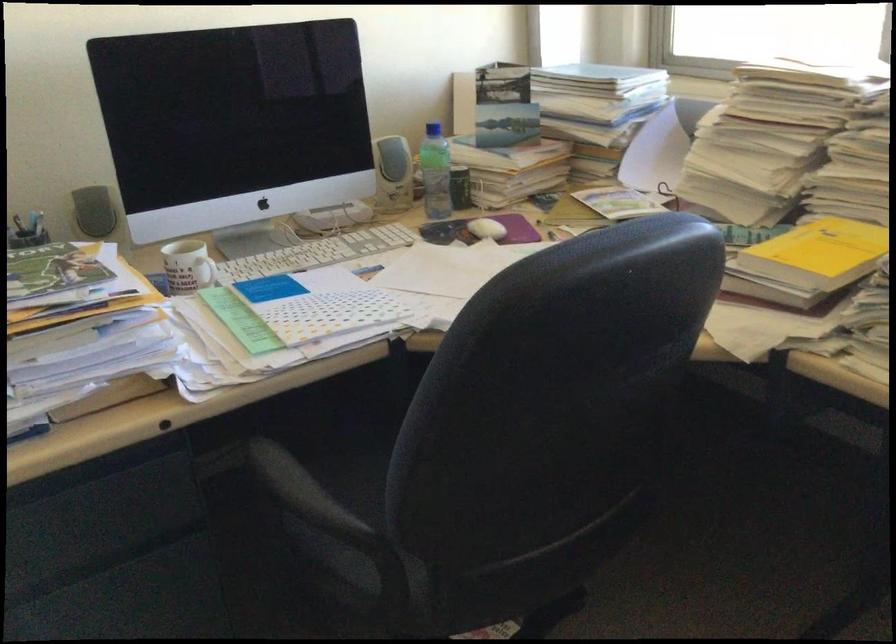
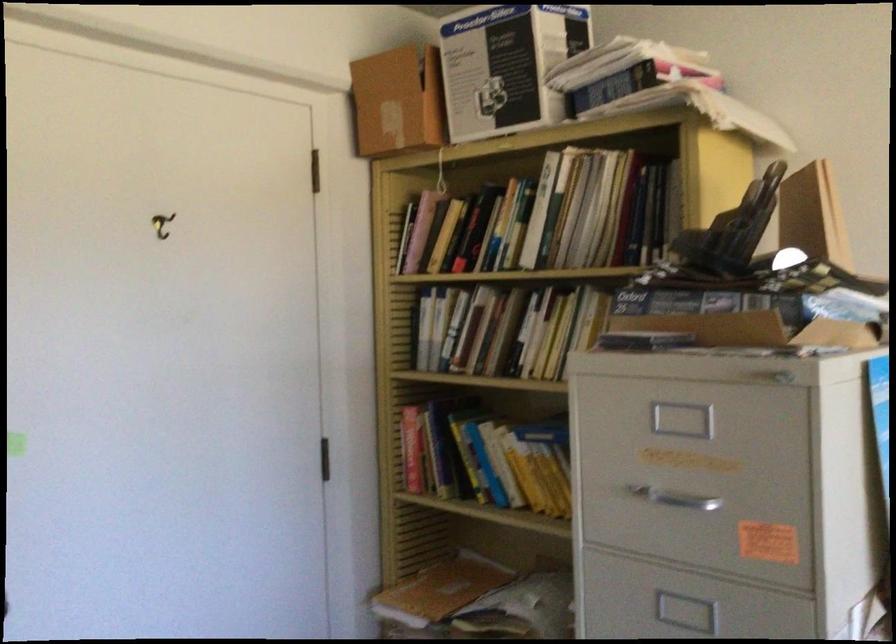
Question: The images are taken continuously from a first-person perspective. In which direction is your viewpoint rotating?

Choices:
 (A) Left
 (B) Right
 (C) Up
 (D) Down

Answer: (A)